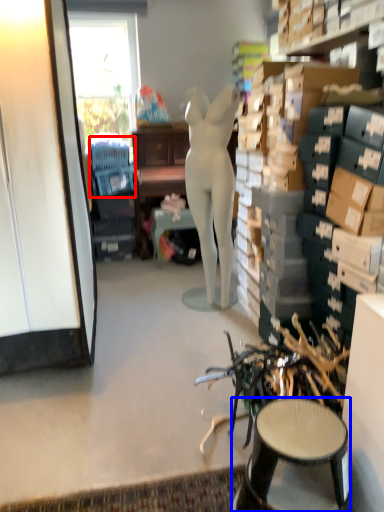
Question: Which object is further to the camera taking this photo, swivel chair (highlighted by a red box) or stool (highlighted by a blue box)?

Choices:
 (A) swivel chair
 (B) stool

Answer: (A)